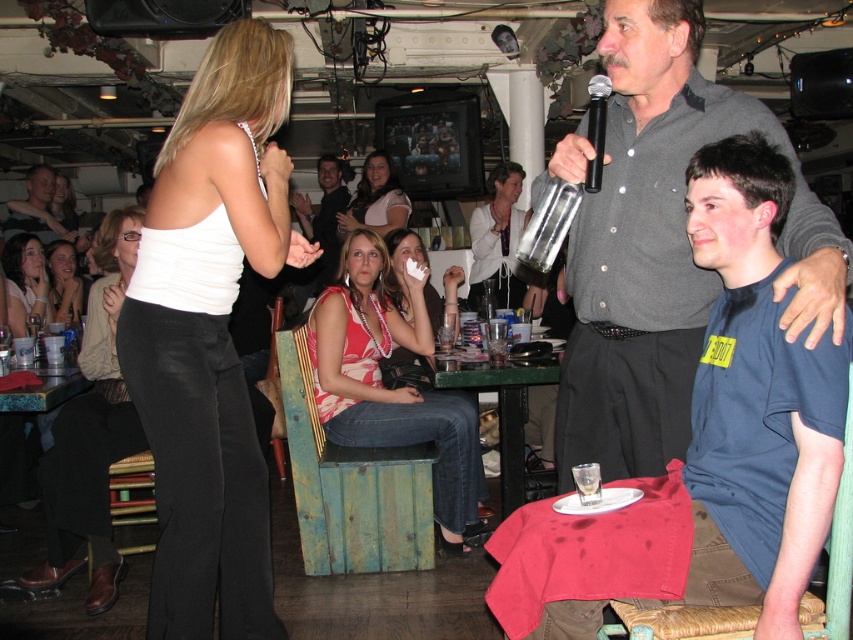
Question: Which of the following is the farthest from the observer?

Choices:
 (A) matte pink dress at lower left
 (B) matte black pants at lower left

Answer: (A)

Question: Does white matte tank top at center appear over black plastic microphone at upper center?

Choices:
 (A) yes
 (B) no

Answer: (B)

Question: Which point appears farthest from the camera in this image?

Choices:
 (A) (653, 273)
 (B) (473, 248)
 (C) (74, 310)

Answer: (B)

Question: Can you confirm if matte pink top at center is thinner than matte black shirt at upper left?

Choices:
 (A) yes
 (B) no

Answer: (A)

Question: Is matte pink blouse at center bigger than matte black shirt at upper left?

Choices:
 (A) no
 (B) yes

Answer: (A)

Question: Which object appears farthest from the camera in this image?

Choices:
 (A) matte black pants at lower left
 (B) floral tank top at center
 (C) gray button-up shirt at center
 (D) matte pink dress at center

Answer: (D)